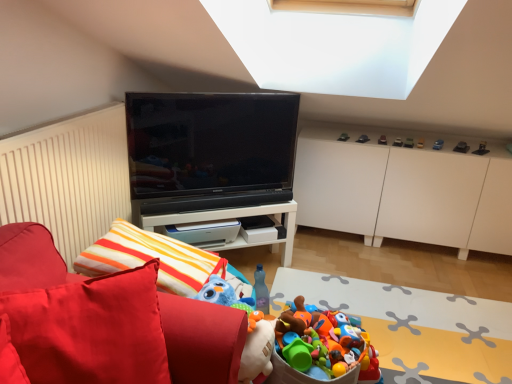
The height and width of the screenshot is (384, 512). Find the location of `free space to the right of metallic gold car at upper right, the sixth toy in the top-to-bottom sequence`. free space to the right of metallic gold car at upper right, the sixth toy in the top-to-bottom sequence is located at coordinates click(x=443, y=144).